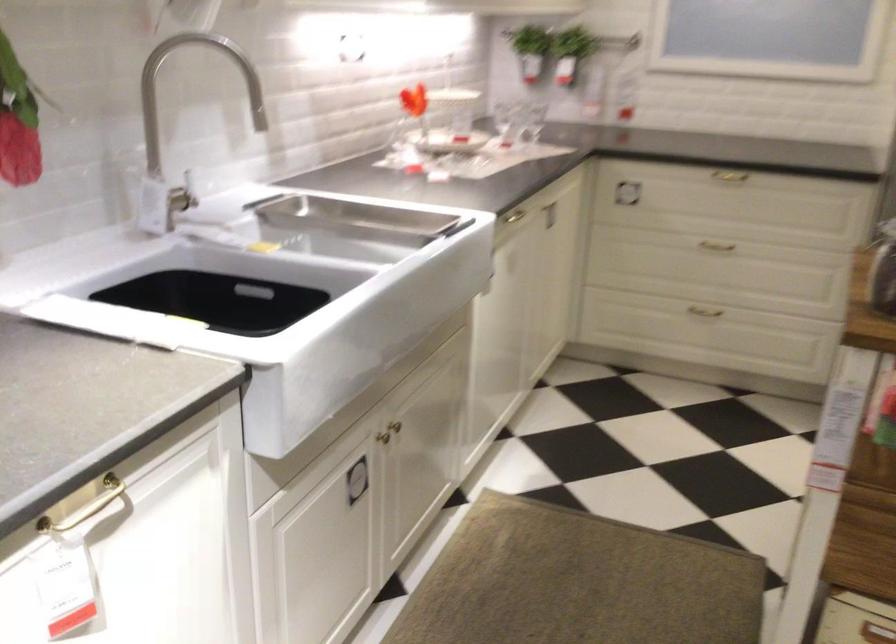
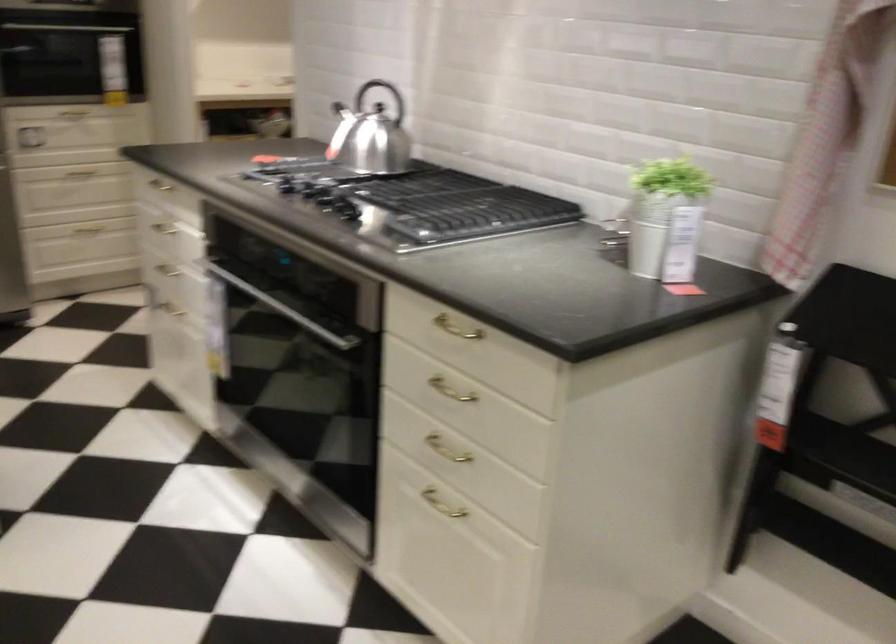
Question: The camera is either moving clockwise (left) or counter-clockwise (right) around the object. The first image is from the beginning of the video and the second image is from the end. Is the camera moving left or right when shooting the video?

Choices:
 (A) Left
 (B) Right

Answer: (A)